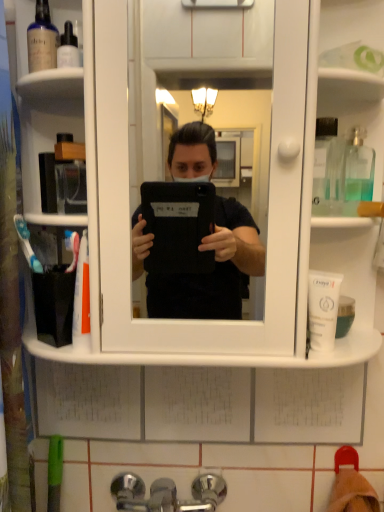
Measure the distance between point (36, 32) and camera.

Point (36, 32) is 63.10 centimeters from camera.

Where is `clear glass bottle at upper right, which appears as the second mouthwash when viewed from the top`? This screenshot has width=384, height=512. clear glass bottle at upper right, which appears as the second mouthwash when viewed from the top is located at coordinates (358, 167).

The width and height of the screenshot is (384, 512). Find the location of `chrome metallic faucet at lower center`. chrome metallic faucet at lower center is located at coordinates (167, 494).

Considering the sizes of objects chrome metallic faucet at lower center and white matte tube at right, marked as the 1th mouthwash in a bottom-to-top arrangement, in the image provided, who is thinner, chrome metallic faucet at lower center or white matte tube at right, marked as the 1th mouthwash in a bottom-to-top arrangement,?

With smaller width is white matte tube at right, marked as the 1th mouthwash in a bottom-to-top arrangement.

Which of these two, chrome metallic faucet at lower center or white matte tube at right, acting as the 2th mouthwash starting from the left, stands shorter?

Standing shorter between the two is white matte tube at right, acting as the 2th mouthwash starting from the left.

From the image's perspective, which one is positioned lower, chrome metallic faucet at lower center or white matte tube at right, acting as the 2th mouthwash starting from the left?

chrome metallic faucet at lower center.

Does chrome metallic faucet at lower center contain white matte tube at right, marked as the 1th mouthwash in a bottom-to-top arrangement?

No, white matte tube at right, marked as the 1th mouthwash in a bottom-to-top arrangement, is not inside chrome metallic faucet at lower center.

From a real-world perspective, does white matte tube at right, acting as the 2th mouthwash starting from the left, sit lower than chrome metallic faucet at lower center?

No.

Which of these two, white matte tube at right, acting as the 2th mouthwash starting from the left, or chrome metallic faucet at lower center, is bigger?

With larger size is chrome metallic faucet at lower center.

Based on their positions, is white matte tube at right, which appears as the 2th mouthwash when viewed from the right, located to the left or right of chrome metallic faucet at lower center?

white matte tube at right, which appears as the 2th mouthwash when viewed from the right, is to the right of chrome metallic faucet at lower center.

Who is shorter, white matte tube at right, marked as the 1th mouthwash in a bottom-to-top arrangement, or chrome metallic faucet at lower center?

With less height is white matte tube at right, marked as the 1th mouthwash in a bottom-to-top arrangement.

Is chrome metallic faucet at lower center far away from translucent glass mouthwash at upper left, the third mouthwash from the bottom?

chrome metallic faucet at lower center is actually quite close to translucent glass mouthwash at upper left, the third mouthwash from the bottom.

Image resolution: width=384 pixels, height=512 pixels. Find the location of `tap that appears on the right of translucent glass mouthwash at upper left, the third mouthwash from the bottom`. tap that appears on the right of translucent glass mouthwash at upper left, the third mouthwash from the bottom is located at coordinates (167, 494).

Based on the photo, from the image's perspective, is chrome metallic faucet at lower center located above translucent glass mouthwash at upper left, which is the 1th mouthwash in top-to-bottom order?

Actually, chrome metallic faucet at lower center appears below translucent glass mouthwash at upper left, which is the 1th mouthwash in top-to-bottom order, in the image.

Is point (318, 348) positioned behind point (353, 152)?

No, it is in front of (353, 152).

Would you say white matte tube at right, the third mouthwash positioned from the top, is outside clear glass bottle at upper right, the second mouthwash in the bottom-to-top sequence?

Absolutely, white matte tube at right, the third mouthwash positioned from the top, is external to clear glass bottle at upper right, the second mouthwash in the bottom-to-top sequence.

Locate an element on the screen. Image resolution: width=384 pixels, height=512 pixels. mouthwash that appears below the clear glass bottle at upper right, the 3th mouthwash viewed from the left (from the image's perspective) is located at coordinates (323, 309).

Does white matte tube at right, marked as the 1th mouthwash in a bottom-to-top arrangement, lie in front of clear glass bottle at upper right, the 3th mouthwash viewed from the left?

That is True.

Identify the location of the 2nd mouthwash above when counting from the white plastic cabinet at center (from the image's perspective). (42, 40).

Which of these two, white plastic cabinet at center or translucent glass mouthwash at upper left, the 3th mouthwash positioned from the right, stands taller?

white plastic cabinet at center.

In the scene shown: Is white plastic cabinet at center not close to translucent glass mouthwash at upper left, which appears as the first mouthwash when viewed from the left?

No.

Considering the sizes of white plastic cabinet at center and translucent glass mouthwash at upper left, the 3th mouthwash positioned from the right, in the image, is white plastic cabinet at center wider or thinner than translucent glass mouthwash at upper left, the 3th mouthwash positioned from the right,?

Clearly, white plastic cabinet at center has more width compared to translucent glass mouthwash at upper left, the 3th mouthwash positioned from the right.

Measure the distance between clear glass bottle at upper right, the 3th mouthwash viewed from the left, and translucent glass mouthwash at upper left, the third mouthwash from the bottom.

clear glass bottle at upper right, the 3th mouthwash viewed from the left, is 19.16 inches away from translucent glass mouthwash at upper left, the third mouthwash from the bottom.

Is clear glass bottle at upper right, the 3th mouthwash viewed from the left, next to translucent glass mouthwash at upper left, which is the 1th mouthwash in top-to-bottom order?

No.

From the image's perspective, is clear glass bottle at upper right, the 3th mouthwash viewed from the left, below translucent glass mouthwash at upper left, the third mouthwash from the bottom?

Correct, clear glass bottle at upper right, the 3th mouthwash viewed from the left, appears lower than translucent glass mouthwash at upper left, the third mouthwash from the bottom, in the image.

I want to click on mouthwash lying above the clear glass bottle at upper right, marked as the 1th mouthwash in a right-to-left arrangement (from the image's perspective), so click(x=42, y=40).

Considering the sizes of white plastic cabinet at center and white matte tube at right, marked as the 1th mouthwash in a bottom-to-top arrangement, in the image, is white plastic cabinet at center taller or shorter than white matte tube at right, marked as the 1th mouthwash in a bottom-to-top arrangement,?

In the image, white plastic cabinet at center appears to be taller than white matte tube at right, marked as the 1th mouthwash in a bottom-to-top arrangement.

Between white plastic cabinet at center and white matte tube at right, marked as the 1th mouthwash in a bottom-to-top arrangement, which one has larger width?

white plastic cabinet at center.

Could you tell me if white plastic cabinet at center is turned towards white matte tube at right, marked as the 1th mouthwash in a bottom-to-top arrangement?

Yes.

Image resolution: width=384 pixels, height=512 pixels. Find the location of `tap that appears below the white matte tube at right, which appears as the 2th mouthwash when viewed from the right (from the image's perspective)`. tap that appears below the white matte tube at right, which appears as the 2th mouthwash when viewed from the right (from the image's perspective) is located at coordinates (167, 494).

Locate an element on the screen. the 1st mouthwash to the right when counting from the chrome metallic faucet at lower center is located at coordinates (323, 309).

From the image, which object appears to be farther from white plastic cabinet at center, chrome metallic faucet at lower center or clear glass bottle at upper right, the 3th mouthwash viewed from the left?

Based on the image, chrome metallic faucet at lower center appears to be further to white plastic cabinet at center.

Which object lies further to the anchor point white matte tube at right, acting as the 2th mouthwash starting from the left, translucent glass mouthwash at upper left, the 3th mouthwash positioned from the right, or chrome metallic faucet at lower center?

translucent glass mouthwash at upper left, the 3th mouthwash positioned from the right.

Considering their positions, is clear glass bottle at upper right, which appears as the second mouthwash when viewed from the top, positioned further to white plastic cabinet at center than chrome metallic faucet at lower center?

chrome metallic faucet at lower center is further to white plastic cabinet at center.

Based on their spatial positions, is chrome metallic faucet at lower center or white plastic cabinet at center further from clear glass bottle at upper right, the 3th mouthwash viewed from the left?

The object further to clear glass bottle at upper right, the 3th mouthwash viewed from the left, is chrome metallic faucet at lower center.

From the image, which object appears to be nearer to white matte tube at right, which appears as the 2th mouthwash when viewed from the right, white plastic cabinet at center or chrome metallic faucet at lower center?

white plastic cabinet at center.

When comparing their distances from white plastic cabinet at center, does chrome metallic faucet at lower center or translucent glass mouthwash at upper left, which is the 1th mouthwash in top-to-bottom order, seem further?

Among the two, chrome metallic faucet at lower center is located further to white plastic cabinet at center.

Looking at the image, which one is located further to chrome metallic faucet at lower center, clear glass bottle at upper right, marked as the 1th mouthwash in a right-to-left arrangement, or translucent glass mouthwash at upper left, which appears as the first mouthwash when viewed from the left?

translucent glass mouthwash at upper left, which appears as the first mouthwash when viewed from the left, is positioned further to the anchor chrome metallic faucet at lower center.

Based on their spatial positions, is translucent glass mouthwash at upper left, the 3th mouthwash positioned from the right, or white matte tube at right, which appears as the 2th mouthwash when viewed from the right, closer to white plastic cabinet at center?

Based on the image, white matte tube at right, which appears as the 2th mouthwash when viewed from the right, appears to be nearer to white plastic cabinet at center.

Where is `mouthwash located between translucent glass mouthwash at upper left, which is the 1th mouthwash in top-to-bottom order, and clear glass bottle at upper right, which appears as the second mouthwash when viewed from the top, in the left-right direction`? mouthwash located between translucent glass mouthwash at upper left, which is the 1th mouthwash in top-to-bottom order, and clear glass bottle at upper right, which appears as the second mouthwash when viewed from the top, in the left-right direction is located at coordinates (323, 309).

Find the location of a particular element. mouthwash between white plastic cabinet at center and chrome metallic faucet at lower center in the up-down direction is located at coordinates coord(323,309).

The width and height of the screenshot is (384, 512). Identify the location of cabinet between translucent glass mouthwash at upper left, the 3th mouthwash positioned from the right, and chrome metallic faucet at lower center from top to bottom. (268, 213).

Identify the location of cabinet between clear glass bottle at upper right, which appears as the second mouthwash when viewed from the top, and white matte tube at right, acting as the 2th mouthwash starting from the left, in the vertical direction. This screenshot has width=384, height=512. (268, 213).